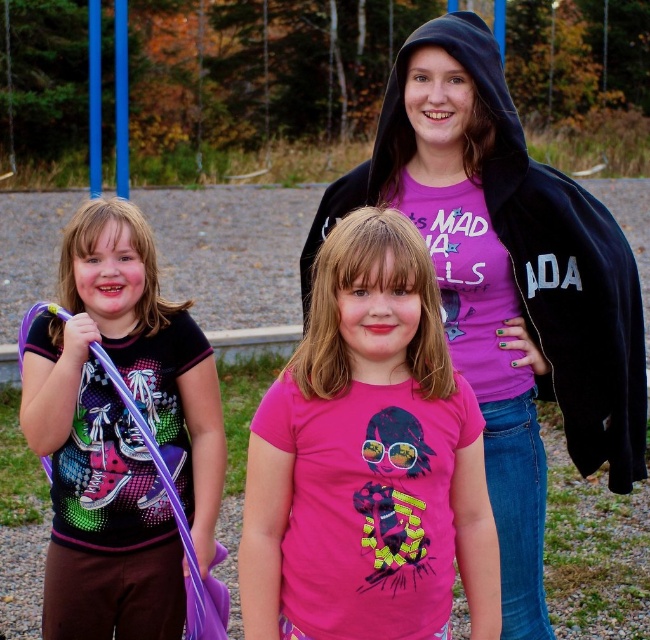
Does matte black hoodie at upper center have a greater width compared to matte purple wand at left?

Correct, the width of matte black hoodie at upper center exceeds that of matte purple wand at left.

Does matte black hoodie at upper center have a lesser width compared to matte purple wand at left?

No.

Is point (515, 436) positioned after point (70, 339)?

Yes, point (515, 436) is farther from viewer.

Where is `matte black hoodie at upper center`? matte black hoodie at upper center is located at coordinates (508, 284).

Is matte black hoodie at upper center positioned before pink matte t-shirt at center?

No, it is behind pink matte t-shirt at center.

Which is above, matte black hoodie at upper center or pink matte t-shirt at center?

Positioned higher is matte black hoodie at upper center.

You are a GUI agent. You are given a task and a screenshot of the screen. Output one action in this format:
    pyautogui.click(x=<x>, y=<y>)
    Task: Click on the matte black hoodie at upper center
    The width and height of the screenshot is (650, 640).
    Given the screenshot: What is the action you would take?
    pyautogui.click(x=508, y=284)

Measure the distance between pink matte t-shirt at center and camera.

8.69 feet

Who is lower down, pink matte t-shirt at center or matte purple wand at left?

matte purple wand at left is below.

Who is more forward, (361, 541) or (195, 496)?

Positioned in front is point (361, 541).

This screenshot has width=650, height=640. What are the coordinates of `pink matte t-shirt at center` in the screenshot? It's located at (367, 460).